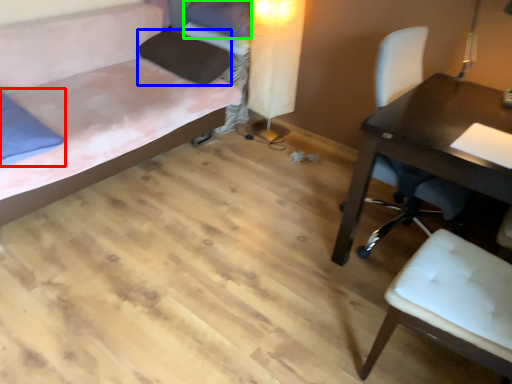
Question: Considering the real-world distances, which object is closest to pillow (highlighted by a red box)? pillow (highlighted by a blue box) or pillow (highlighted by a green box).

Choices:
 (A) pillow
 (B) pillow

Answer: (A)